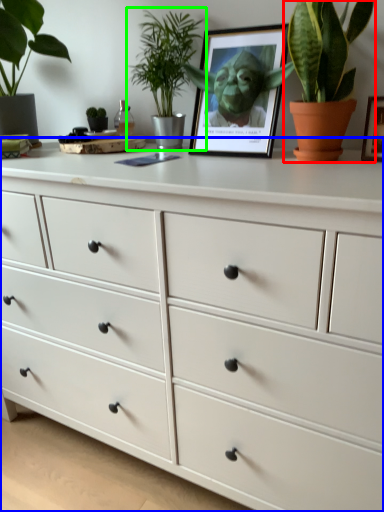
Question: Which is nearer to the houseplant (highlighted by a red box)? chest of drawers (highlighted by a blue box) or houseplant (highlighted by a green box).

Choices:
 (A) chest of drawers
 (B) houseplant

Answer: (B)